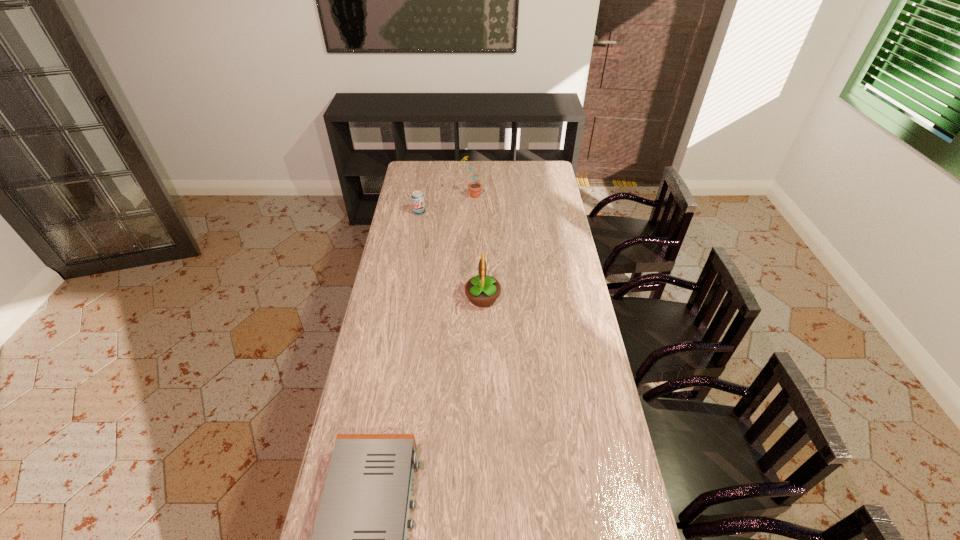
Image resolution: width=960 pixels, height=540 pixels. I want to click on the farthest object, so click(x=475, y=188).

At what (x,y) coordinates should I click in order to perform the action: click on the nearer sunflower. Please return your answer as a coordinate pair (x, y). This screenshot has width=960, height=540. Looking at the image, I should click on (482, 290).

I want to click on the second shortest object, so click(418, 202).

The height and width of the screenshot is (540, 960). What are the coordinates of `beer can` in the screenshot? It's located at (418, 202).

This screenshot has width=960, height=540. In order to click on free space located on the flower of the farther sunflower in this screenshot , I will do `click(523, 196)`.

Where is `vacant space situated 0.110m on the face of the nearer sunflower`? This screenshot has height=540, width=960. vacant space situated 0.110m on the face of the nearer sunflower is located at coordinates (439, 298).

I want to click on vacant space located 0.220m on the face of the nearer sunflower, so click(x=412, y=298).

I want to click on free space located 0.290m on the face of the nearer sunflower, so click(x=395, y=298).

Where is `free point located on the right of the third tallest object`? Image resolution: width=960 pixels, height=540 pixels. free point located on the right of the third tallest object is located at coordinates (474, 212).

Find the location of a particular element. This screenshot has width=960, height=540. object present at the left edge is located at coordinates point(418,202).